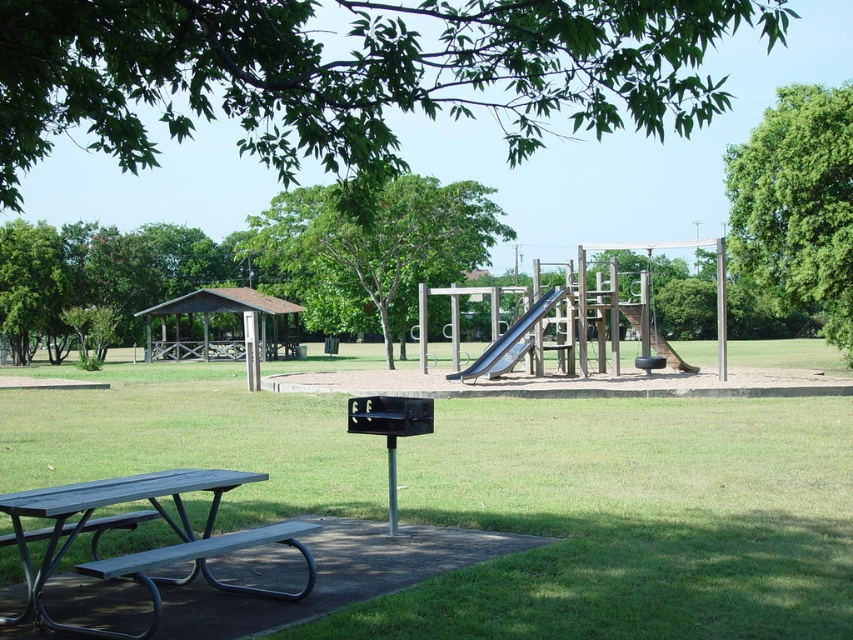
You are planning to set up a picnic blanket in the park. You see the green grass at center and the smooth gray slide at center. Which area should you choose to place your blanket so it is not directly next to the slide?

You should place the picnic blanket on the green grass at center because it is to the left of the smooth gray slide at center, so it won not be directly next to the slide.